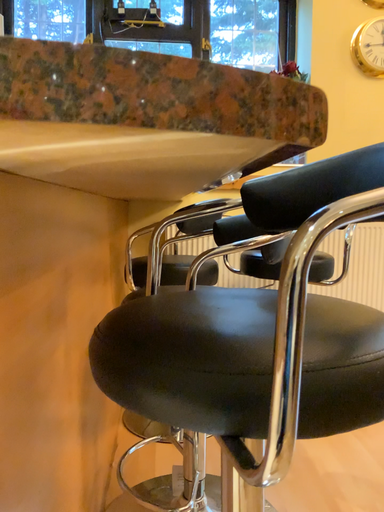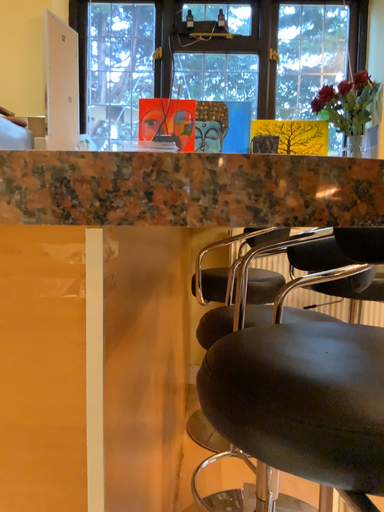
Question: Which way did the camera rotate in the video?

Choices:
 (A) rotated left
 (B) rotated right

Answer: (A)